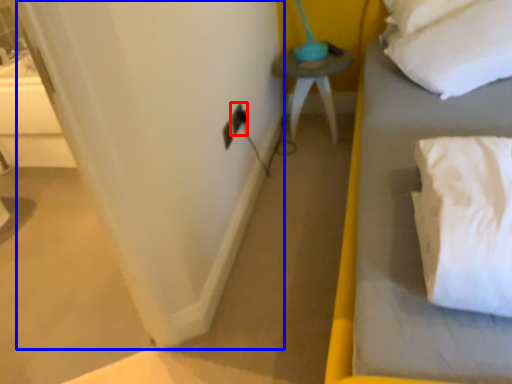
Question: Which object is further to the camera taking this photo, electric outlet (highlighted by a red box) or curtain (highlighted by a blue box)?

Choices:
 (A) electric outlet
 (B) curtain

Answer: (A)